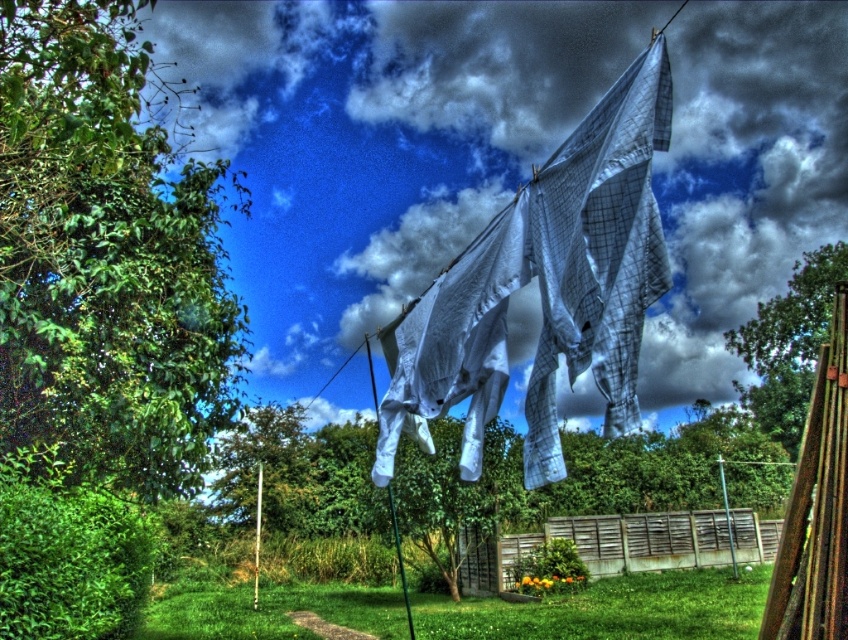
Question: Which point is closer to the camera taking this photo?

Choices:
 (A) (499, 216)
 (B) (751, 333)
 (C) (71, 365)
 (D) (355, 624)

Answer: (A)

Question: Does green leafy tree at left lie in front of green leafy tree at upper center?

Choices:
 (A) yes
 (B) no

Answer: (A)

Question: Among these objects, which one is nearest to the camera?

Choices:
 (A) white quilted fabric at center
 (B) green leafy tree at left
 (C) green grass at lower center

Answer: (B)

Question: Is green leafy tree at left above green grass at lower center?

Choices:
 (A) no
 (B) yes

Answer: (B)

Question: Which of the following is the farthest from the observer?

Choices:
 (A) green leafy tree at upper center
 (B) green grass at lower center

Answer: (A)

Question: Does white quilted fabric at center have a smaller size compared to green leafy tree at upper center?

Choices:
 (A) no
 (B) yes

Answer: (B)